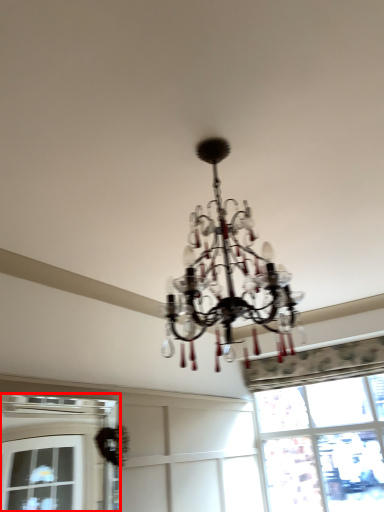
Question: From the image's perspective, what is the correct spatial positioning of window (annotated by the red box) in reference to window?

Choices:
 (A) below
 (B) above

Answer: (B)